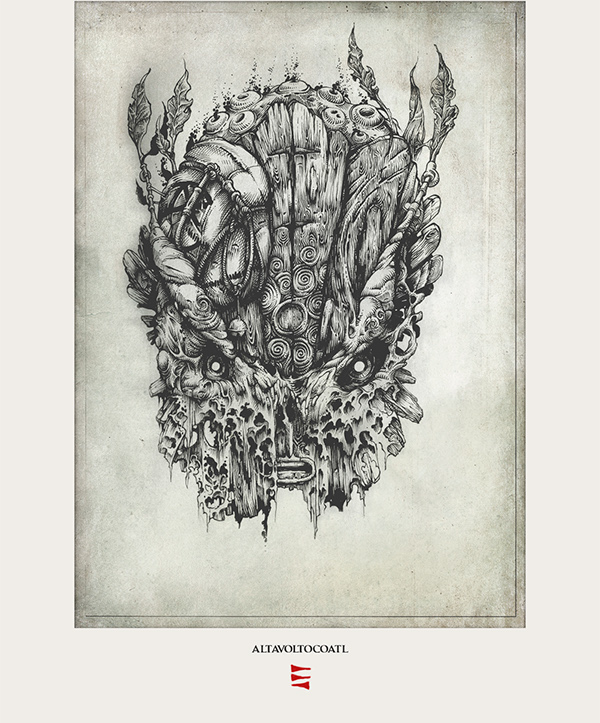
The width and height of the screenshot is (600, 723). In order to click on the bottom right white corner photo mat in this screenshot , I will do `click(598, 721)`.